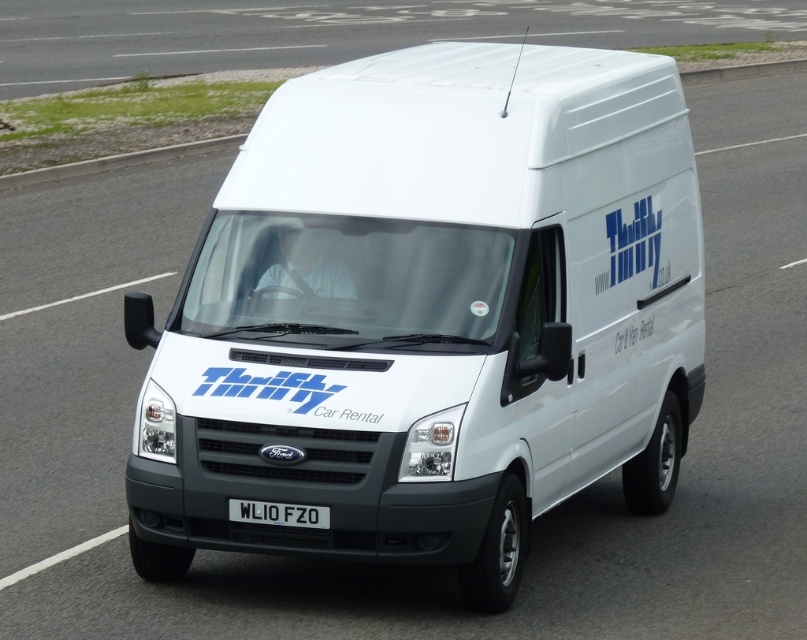
Question: Is white matte van at center to the left of black plastic license plate at center from the viewer's perspective?

Choices:
 (A) yes
 (B) no

Answer: (B)

Question: Estimate the real-world distances between objects in this image. Which object is farther from the white smooth roof at upper center?

Choices:
 (A) black plastic license plate at center
 (B) white matte van at center

Answer: (A)

Question: From the image, what is the correct spatial relationship of white matte van at center in relation to black plastic license plate at center?

Choices:
 (A) left
 (B) right

Answer: (B)

Question: Is white matte van at center to the left of white smooth roof at upper center from the viewer's perspective?

Choices:
 (A) no
 (B) yes

Answer: (B)

Question: Which of these objects is positioned farthest from the black plastic license plate at center?

Choices:
 (A) white matte van at center
 (B) white smooth roof at upper center

Answer: (B)

Question: Among these points, which one is nearest to the camera?

Choices:
 (A) (289, 58)
 (B) (235, 513)
 (C) (408, 260)

Answer: (B)